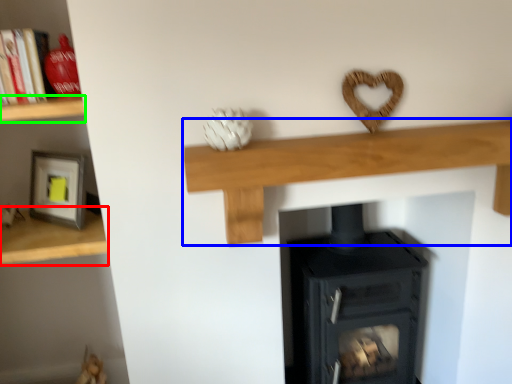
Question: Estimate the real-world distances between objects in this image. Which object is farther from shelf (highlighted by a red box), shelf (highlighted by a blue box) or shelf (highlighted by a green box)?

Choices:
 (A) shelf
 (B) shelf

Answer: (A)